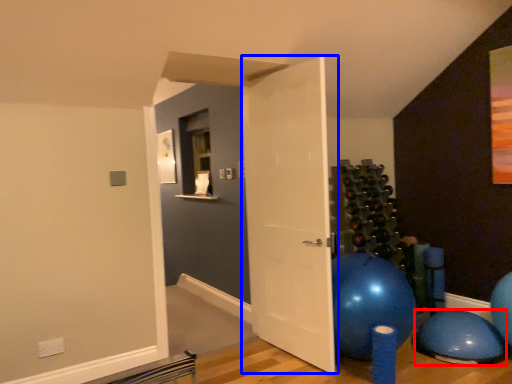
Question: Which object appears farthest to the camera in this image, balloon (highlighted by a red box) or door (highlighted by a blue box)?

Choices:
 (A) balloon
 (B) door

Answer: (A)